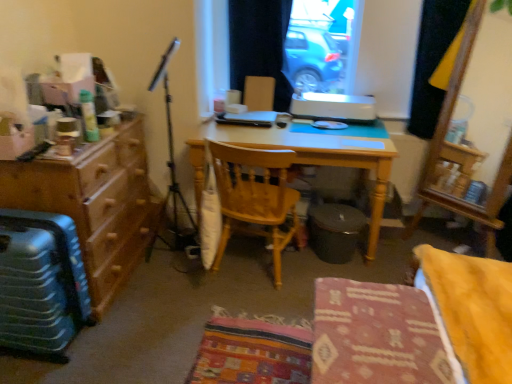
Find the location of a particular element. free space below wooden chair at center, marked as the 2th chair in a front-to-back arrangement (from a real-world perspective) is located at coordinates (252, 271).